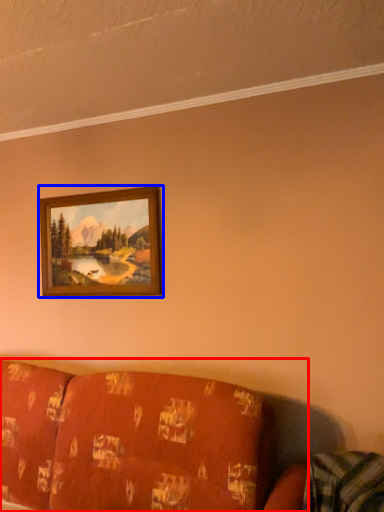
Question: Which of the following is the farthest to the observer, studio couch (highlighted by a red box) or picture frame (highlighted by a blue box)?

Choices:
 (A) studio couch
 (B) picture frame

Answer: (B)